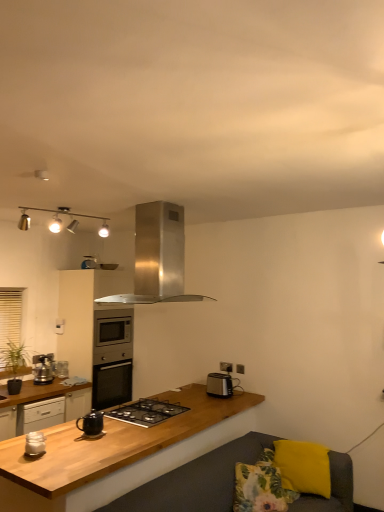
Locate an element on the screen. Image resolution: width=384 pixels, height=512 pixels. free space in front of white glossy jar at lower left, which is counted as the 4th kitchen appliance, starting from the back is located at coordinates (27, 466).